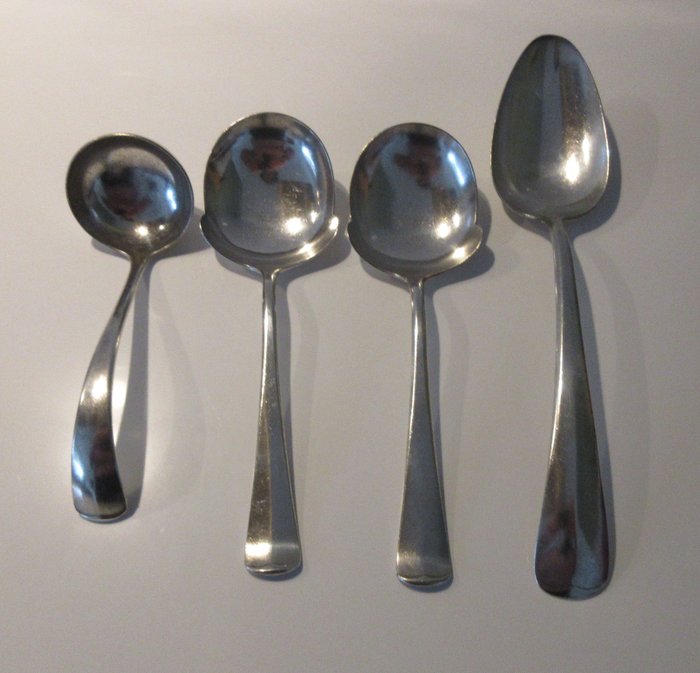
The width and height of the screenshot is (700, 673). I want to click on spoon handles, so click(103, 470), click(276, 511), click(421, 538), click(589, 531).